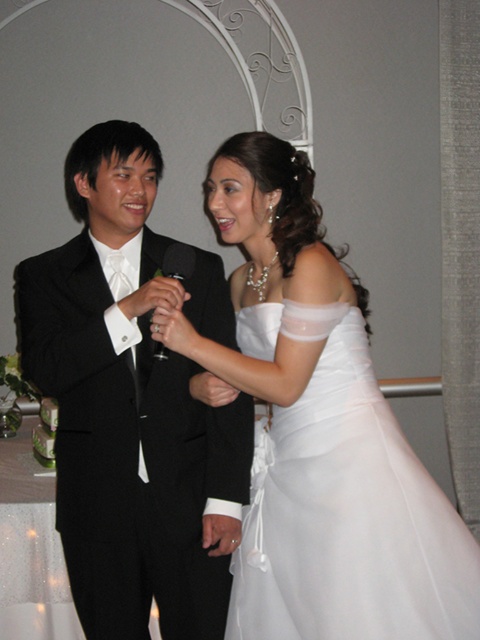
Is the position of black satin suit at left more distant than that of white satin dress at center?

Yes, it is.

Is black satin suit at left above white satin dress at center?

Correct, black satin suit at left is located above white satin dress at center.

Who is more distant from viewer, [168,493] or [343,454]?

The point [168,493] is more distant.

At what (x,y) coordinates should I click in order to perform the action: click on black satin suit at left. Please return your answer as a coordinate pair (x, y). The image size is (480, 640). Looking at the image, I should click on pos(132,404).